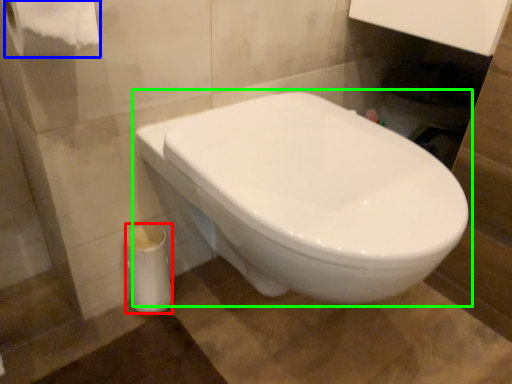
Question: Estimate the real-world distances between objects in this image. Which object is closer to porcelain (highlighted by a red box), toilet paper (highlighted by a blue box) or toilet (highlighted by a green box)?

Choices:
 (A) toilet paper
 (B) toilet

Answer: (B)